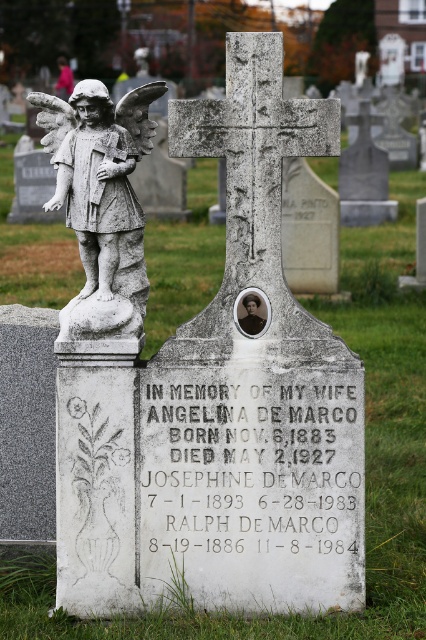
Who is lower down, white marble statue at upper left or white stone angel at left?

Positioned lower is white marble statue at upper left.

Is point (270, 547) closer to camera compared to point (109, 221)?

No, (270, 547) is behind (109, 221).

Does point (226, 70) come closer to viewer compared to point (68, 310)?

No.

This screenshot has width=426, height=640. I want to click on white marble statue at upper left, so click(219, 404).